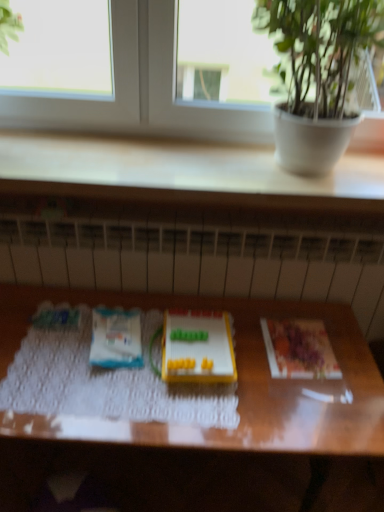
Question: Considering the relative sizes of wooden table at center and printed paper at right, the 2th paperback book viewed from the left, in the image provided, is wooden table at center wider than printed paper at right, the 2th paperback book viewed from the left,?

Choices:
 (A) no
 (B) yes

Answer: (B)

Question: Considering the relative sizes of wooden table at center and printed paper at right, the 2th paperback book viewed from the left, in the image provided, is wooden table at center thinner than printed paper at right, the 2th paperback book viewed from the left,?

Choices:
 (A) no
 (B) yes

Answer: (A)

Question: Does wooden table at center turn towards printed paper at right, the 2th paperback book viewed from the left?

Choices:
 (A) no
 (B) yes

Answer: (A)

Question: Can you confirm if wooden table at center is positioned to the left of printed paper at right, the 2th paperback book viewed from the left?

Choices:
 (A) yes
 (B) no

Answer: (A)

Question: From a real-world perspective, is wooden table at center below printed paper at right, which appears as the first paperback book when viewed from the right?

Choices:
 (A) yes
 (B) no

Answer: (A)

Question: From a real-world perspective, relative to transparent glass window at upper center, is printed paper at right, which appears as the first paperback book when viewed from the right, vertically above or below?

Choices:
 (A) below
 (B) above

Answer: (A)

Question: In terms of width, does printed paper at right, which appears as the first paperback book when viewed from the right, look wider or thinner when compared to transparent glass window at upper center?

Choices:
 (A) thin
 (B) wide

Answer: (B)

Question: Choose the correct answer: Is printed paper at right, the 2th paperback book viewed from the left, inside transparent glass window at upper center or outside it?

Choices:
 (A) inside
 (B) outside

Answer: (B)

Question: From the image's perspective, is printed paper at right, which appears as the first paperback book when viewed from the right, located above or below transparent glass window at upper center?

Choices:
 (A) above
 (B) below

Answer: (B)

Question: Based on their sizes in the image, would you say printed paper at right, which appears as the first paperback book when viewed from the right, is bigger or smaller than yellow plastic toy at center?

Choices:
 (A) small
 (B) big

Answer: (A)

Question: In terms of height, does printed paper at right, the 2th paperback book viewed from the left, look taller or shorter compared to yellow plastic toy at center?

Choices:
 (A) short
 (B) tall

Answer: (A)

Question: Is printed paper at right, which appears as the first paperback book when viewed from the right, wider or thinner than yellow plastic toy at center?

Choices:
 (A) thin
 (B) wide

Answer: (A)

Question: From the image's perspective, relative to yellow plastic toy at center, is printed paper at right, the 2th paperback book viewed from the left, above or below?

Choices:
 (A) above
 (B) below

Answer: (B)

Question: From the image's perspective, is printed paper at right, which appears as the first paperback book when viewed from the right, above or below white matte paper at center, which is the 2th paperback book from right to left?

Choices:
 (A) below
 (B) above

Answer: (A)

Question: In terms of size, does printed paper at right, the 2th paperback book viewed from the left, appear bigger or smaller than white matte paper at center, which is the 2th paperback book from right to left?

Choices:
 (A) small
 (B) big

Answer: (A)